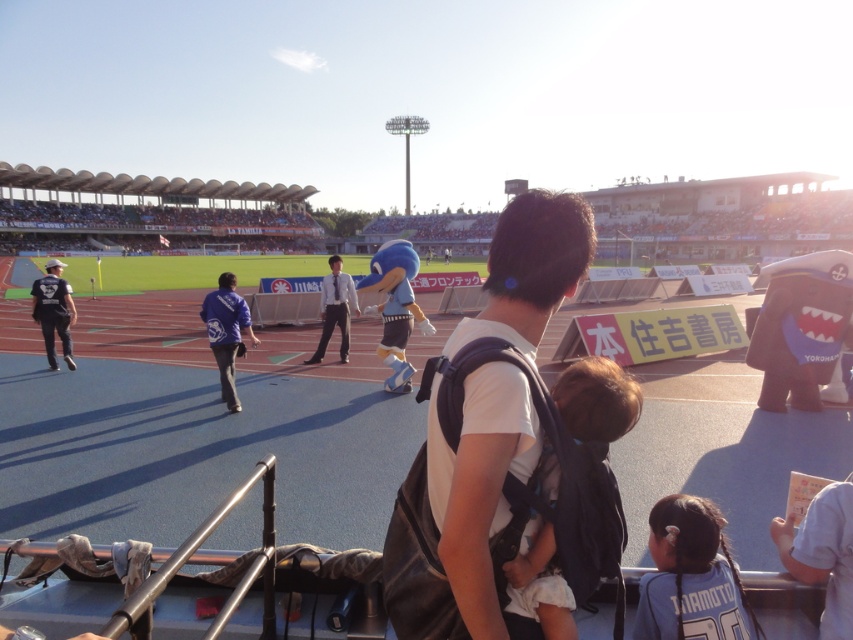
You are a photographer at the stadium and want to take a photo of both the blue jersey at lower right and the dark blue jersey at left. Which jersey should you focus on first if you want to capture them from left to right order?

You should focus on the dark blue jersey at left first because it is positioned to the left of the blue jersey at lower right.

You are a photographer at the stadium and want to capture both the blue jersey at lower right and the white shirt and tie at center in a single shot. Which clothing item should you focus on first to ensure both are in frame?

The blue jersey at lower right has a smaller size compared to white shirt and tie at center. To capture both in a single shot, focus on the white shirt and tie at center first since it is larger and will be easier to frame, then adjust to include the smaller blue jersey at lower right.